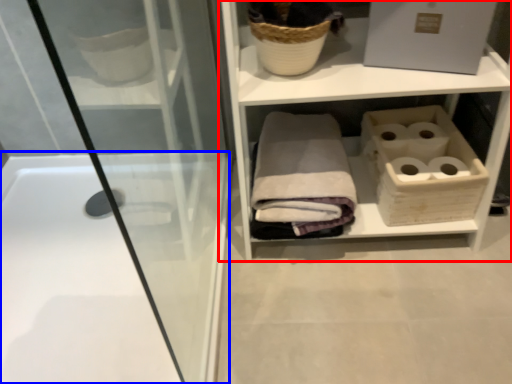
Question: Which of the following is the farthest to the observer, shelf (highlighted by a red box) or bathtub (highlighted by a blue box)?

Choices:
 (A) shelf
 (B) bathtub

Answer: (B)